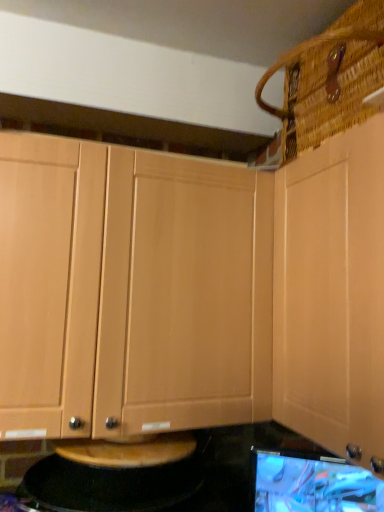
Question: Is point (292, 396) closer or farther from the camera than point (205, 394)?

Choices:
 (A) farther
 (B) closer

Answer: (B)

Question: From a real-world perspective, is light wood cabinet at upper right, the second cabinetry viewed from the left, above or below light wood cabinet at center, which ranks as the 1th cabinetry in left-to-right order?

Choices:
 (A) below
 (B) above

Answer: (B)

Question: Estimate the real-world distances between objects in this image. Which object is farther from the matte black monitor at lower right?

Choices:
 (A) light wood cabinet at upper right, the second cabinetry viewed from the left
 (B) woven brown basket at upper right
 (C) light wood cabinet at center, which ranks as the 1th cabinetry in left-to-right order
 (D) black granite countertop at lower center

Answer: (B)

Question: Estimate the real-world distances between objects in this image. Which object is farther from the light wood cabinet at center, which ranks as the 1th cabinetry in left-to-right order?

Choices:
 (A) matte black monitor at lower right
 (B) light wood cabinet at upper right, which is the first cabinetry in right-to-left order
 (C) black granite countertop at lower center
 (D) woven brown basket at upper right

Answer: (D)